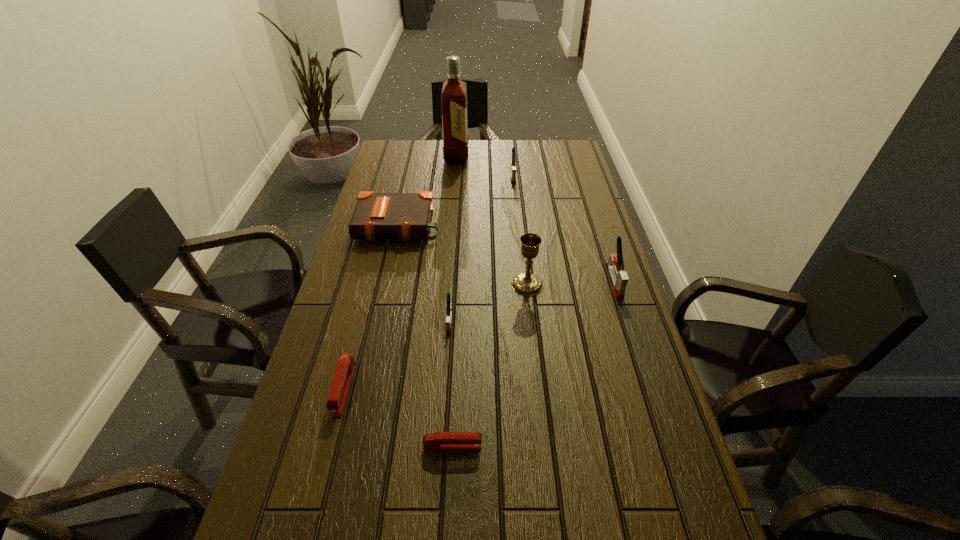
Identify the location of vacant space located 0.140m on the front-facing side of the farther red stapler. This screenshot has height=540, width=960. (319, 483).

You are a GUI agent. You are given a task and a screenshot of the screen. Output one action in this format:
    pyautogui.click(x=<x>, y=<y>)
    Task: Click on the free space located 0.270m on the front-facing side of the shortest stapler
    This screenshot has height=540, width=960.
    Given the screenshot: What is the action you would take?
    pyautogui.click(x=612, y=446)

The image size is (960, 540). Identify the location of object located at the far edge. (454, 92).

Image resolution: width=960 pixels, height=540 pixels. Identify the location of Bible that is at the left edge. (407, 216).

Where is `stapler situated at the left edge`? The image size is (960, 540). stapler situated at the left edge is located at coordinates (339, 389).

Where is `object that is at the right edge`? This screenshot has width=960, height=540. object that is at the right edge is located at coordinates (615, 266).

Where is `vacant space at the far edge of the desktop`? This screenshot has width=960, height=540. vacant space at the far edge of the desktop is located at coordinates (536, 167).

Where is `free region at the left edge of the desktop`? The height and width of the screenshot is (540, 960). free region at the left edge of the desktop is located at coordinates (322, 504).

In the image, there is a desktop. Where is `free space at the right edge`? free space at the right edge is located at coordinates (606, 346).

In the image, there is a desktop. In order to click on free region at the far left corner in this screenshot , I will do `click(383, 161)`.